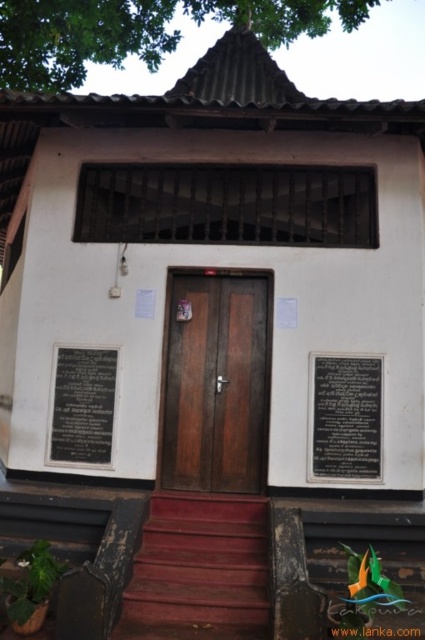
Does smooth red stairs at center appear on the right side of black polished stone plaque at center?

No, smooth red stairs at center is not to the right of black polished stone plaque at center.

Measure the distance between smooth red stairs at center and black polished stone plaque at center.

smooth red stairs at center and black polished stone plaque at center are 4.88 feet apart.

Locate an element on the screen. The height and width of the screenshot is (640, 425). smooth red stairs at center is located at coordinates (198, 570).

Is the position of brown wooden door at center less distant than that of black polished stone plaque at lower left?

Yes.

Does point (212, 320) come farther from viewer compared to point (73, 420)?

Yes, point (212, 320) is behind point (73, 420).

This screenshot has height=640, width=425. Find the location of `brown wooden door at center`. brown wooden door at center is located at coordinates (215, 381).

Between brown wooden door at center and black polished stone plaque at center, which one is positioned lower?

black polished stone plaque at center is below.

Between point (268, 284) and point (323, 429), which one is positioned in front?

Point (323, 429)

Between point (218, 312) and point (356, 448), which one is positioned in front?

Positioned in front is point (356, 448).

Identify the location of brown wooden door at center. (215, 381).